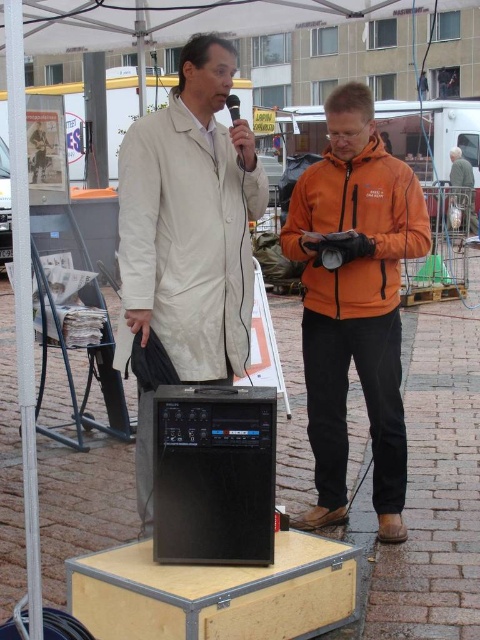
Can you confirm if matte white coat at center is shorter than orange fleece jacket at center?

In fact, matte white coat at center may be taller than orange fleece jacket at center.

Who is more forward, (123, 196) or (298, 195)?

Point (123, 196)

I want to click on matte white coat at center, so click(x=190, y=221).